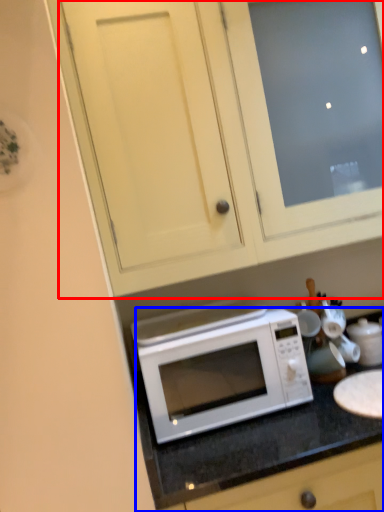
Question: Which of the following is the farthest to the observer, cabinetry (highlighted by a red box) or counter (highlighted by a blue box)?

Choices:
 (A) cabinetry
 (B) counter

Answer: (A)